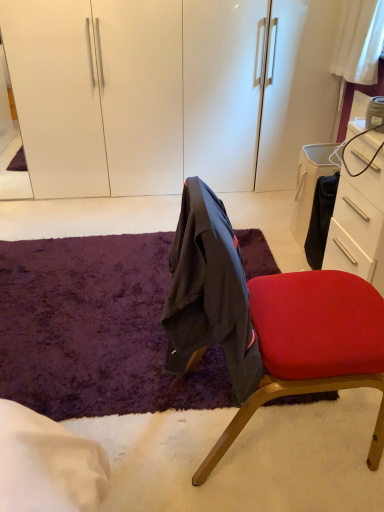
You are a GUI agent. You are given a task and a screenshot of the screen. Output one action in this format:
    pyautogui.click(x=<x>, y=<y>)
    Task: Click on the vacant region above purple shaggy rug at center (from a real-world perspective)
    
    Given the screenshot: What is the action you would take?
    click(x=95, y=278)